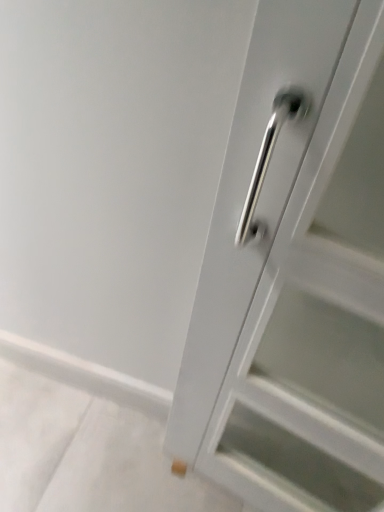
Image resolution: width=384 pixels, height=512 pixels. What do you see at coordinates (295, 273) in the screenshot?
I see `satin silver handle at center` at bounding box center [295, 273].

The height and width of the screenshot is (512, 384). I want to click on satin silver handle at center, so click(295, 273).

Where is `satin silver handle at center`? Image resolution: width=384 pixels, height=512 pixels. satin silver handle at center is located at coordinates (295, 273).